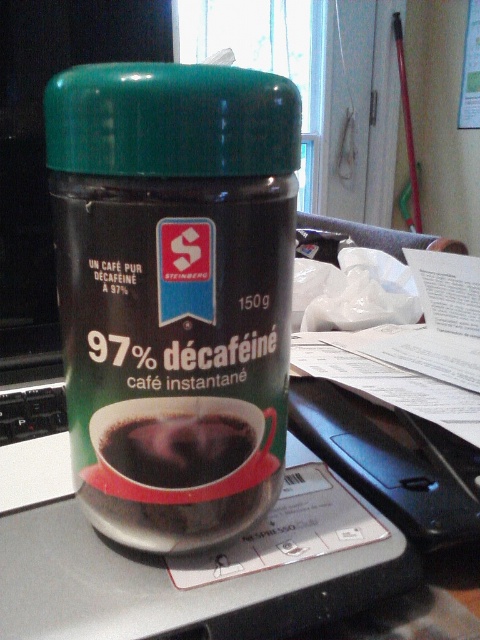
Question: Does green matte jar at center come in front of dark matte coffee cup at center?

Choices:
 (A) yes
 (B) no

Answer: (A)

Question: Which object is the closest to the green matte jar at center?

Choices:
 (A) dark matte coffee cup at center
 (B) green glossy lid at center

Answer: (B)

Question: Among these points, which one is nearest to the camera?

Choices:
 (A) (163, 426)
 (B) (171, 157)
 (C) (201, 122)

Answer: (C)

Question: Which point appears farthest from the camera in this image?

Choices:
 (A) (74, 356)
 (B) (180, 147)
 (C) (141, 420)

Answer: (A)

Question: Is green matte jar at center bigger than green glossy lid at center?

Choices:
 (A) no
 (B) yes

Answer: (B)

Question: Is green matte jar at center below dark matte coffee cup at center?

Choices:
 (A) no
 (B) yes

Answer: (A)